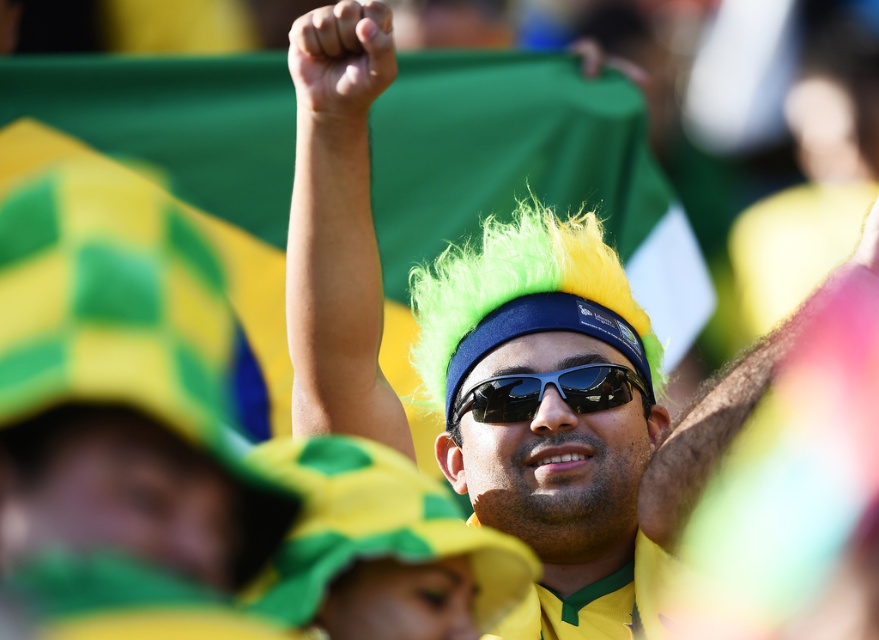
You are a photographer trying to capture a clear photo of the black plastic goggles at center. However, the fluorescent green wig at center is blocking your view. Can you adjust your position to take the photo without the wig blocking it?

The fluorescent green wig at center is in front of the black plastic goggles at center, so moving your position to the side or behind the wig might allow you to capture the goggles without obstruction.

You are a photographer at the event and want to capture a closeup of the fluorescent green wig at center and black plastic goggles at center. Which object should you focus on first if you want to start with the one on the left?

The black plastic goggles at center is on the left side of the fluorescent green wig at center, so you should focus on the black plastic goggles at center first.